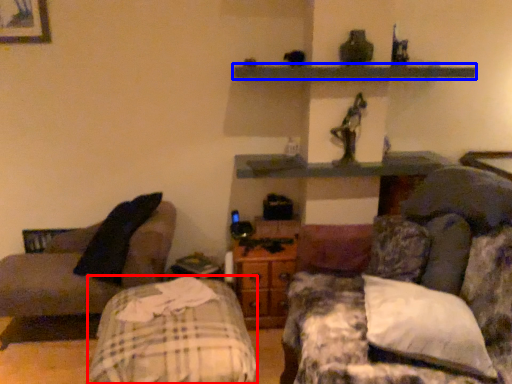
Question: Among these objects, which one is farthest to the camera, bed frame (highlighted by a red box) or shelf (highlighted by a blue box)?

Choices:
 (A) bed frame
 (B) shelf

Answer: (B)